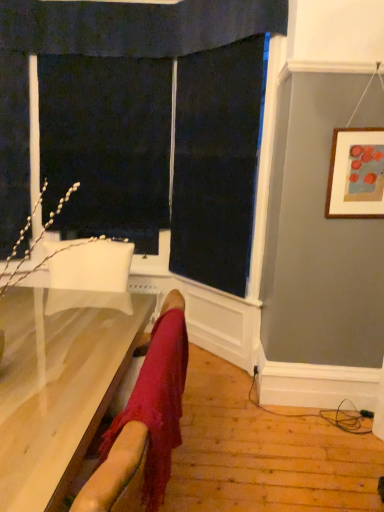
This screenshot has height=512, width=384. I want to click on wooden framed artwork at upper right, so click(x=356, y=174).

Can you confirm if black fabric screen door at upper left is bigger than light wood table at lower left?

Actually, black fabric screen door at upper left might be smaller than light wood table at lower left.

From the image's perspective, is black fabric screen door at upper left below light wood table at lower left?

No.

Based on their positions, is black fabric screen door at upper left located to the left or right of light wood table at lower left?

From the image, it's evident that black fabric screen door at upper left is to the right of light wood table at lower left.

Is wooden framed artwork at upper right far away from black fabric screen door at upper left?

wooden framed artwork at upper right is far away from black fabric screen door at upper left.

In the scene shown: Is wooden framed artwork at upper right not within black fabric screen door at upper left?

Yes, wooden framed artwork at upper right is located beyond the bounds of black fabric screen door at upper left.

In the scene shown: How different are the orientations of wooden framed artwork at upper right and black fabric screen door at upper left in degrees?

The facing directions of wooden framed artwork at upper right and black fabric screen door at upper left are 0.131 degrees apart.

Considering the relative sizes of wooden framed artwork at upper right and black fabric screen door at upper left in the image provided, is wooden framed artwork at upper right wider than black fabric screen door at upper left?

No.

Does wooden framed artwork at upper right contain light wood table at lower left?

No.

Considering the relative sizes of wooden framed artwork at upper right and light wood table at lower left in the image provided, is wooden framed artwork at upper right wider than light wood table at lower left?

No.

From a real-world perspective, does wooden framed artwork at upper right sit lower than light wood table at lower left?

No.

Is black fabric screen door at upper left facing towards wooden framed artwork at upper right?

No, black fabric screen door at upper left does not turn towards wooden framed artwork at upper right.

Looking at this image, between black fabric screen door at upper left and wooden framed artwork at upper right, which one has larger width?

With larger width is black fabric screen door at upper left.

Looking at this image, between black fabric screen door at upper left and wooden framed artwork at upper right, which one has larger size?

black fabric screen door at upper left is bigger.

Is black fabric screen door at upper left next to wooden framed artwork at upper right and touching it?

No.

Relative to black fabric screen door at upper left, is light wood table at lower left in front or behind?

Clearly, light wood table at lower left is in front of black fabric screen door at upper left.

Looking at this image, can you confirm if light wood table at lower left is positioned to the left of black fabric screen door at upper left?

Yes.

Measure the distance between light wood table at lower left and black fabric screen door at upper left.

light wood table at lower left is 1.94 meters from black fabric screen door at upper left.

Considering the positions of points (31, 428) and (352, 135), is point (31, 428) closer to camera compared to point (352, 135)?

Yes, it is in front of point (352, 135).

Between light wood table at lower left and wooden framed artwork at upper right, which one has smaller size?

Smaller between the two is wooden framed artwork at upper right.

This screenshot has height=512, width=384. I want to click on furniture below the wooden framed artwork at upper right (from the image's perspective), so click(56, 390).

I want to click on screen door that is above the light wood table at lower left (from the image's perspective), so click(x=106, y=145).

Locate an element on the screen. The width and height of the screenshot is (384, 512). picture frame on the right of black fabric screen door at upper left is located at coordinates (356, 174).

Considering their positions, is black fabric screen door at upper left positioned further to light wood table at lower left than wooden framed artwork at upper right?

The object further to light wood table at lower left is black fabric screen door at upper left.

When comparing their distances from light wood table at lower left, does wooden framed artwork at upper right or black fabric screen door at upper left seem closer?

wooden framed artwork at upper right is positioned closer to the anchor light wood table at lower left.

From the image, which object appears to be nearer to black fabric screen door at upper left, wooden framed artwork at upper right or light wood table at lower left?

wooden framed artwork at upper right is positioned closer to the anchor black fabric screen door at upper left.

From the image, which object appears to be nearer to black fabric screen door at upper left, light wood table at lower left or wooden framed artwork at upper right?

Among the two, wooden framed artwork at upper right is located nearer to black fabric screen door at upper left.

Based on their spatial positions, is black fabric screen door at upper left or light wood table at lower left further from wooden framed artwork at upper right?

black fabric screen door at upper left.

Based on their spatial positions, is light wood table at lower left or black fabric screen door at upper left further from wooden framed artwork at upper right?

The object further to wooden framed artwork at upper right is black fabric screen door at upper left.

The image size is (384, 512). What are the coordinates of `picture frame positioned between light wood table at lower left and black fabric screen door at upper left from near to far` in the screenshot? It's located at (356, 174).